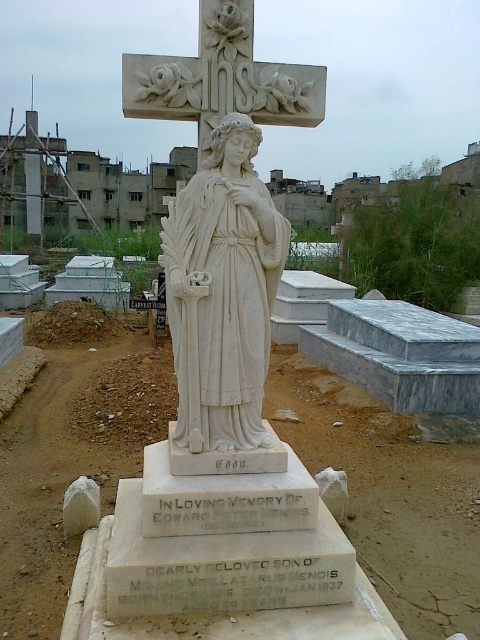
Does white marble cross at upper center have a lesser width compared to white marble crucifix at upper center?

Yes.

Can you confirm if white marble cross at upper center is bigger than white marble crucifix at upper center?

Actually, white marble cross at upper center might be smaller than white marble crucifix at upper center.

Locate an element on the screen. white marble cross at upper center is located at coordinates (223, 77).

Who is positioned more to the right, white marble statue at center or white marble crucifix at upper center?

From the viewer's perspective, white marble statue at center appears more on the right side.

Who is positioned more to the left, white marble statue at center or white marble crucifix at upper center?

From the viewer's perspective, white marble crucifix at upper center appears more on the left side.

Find the location of `white marble statue at center`. white marble statue at center is located at coordinates (223, 291).

Consider the image. Measure the distance from white marble statue at center to white marble cross at upper center.

They are 26.69 inches apart.

Between point (231, 298) and point (278, 90), which one is positioned behind?

Positioned behind is point (278, 90).

Identify the location of white marble statue at center. The image size is (480, 640). (223, 291).